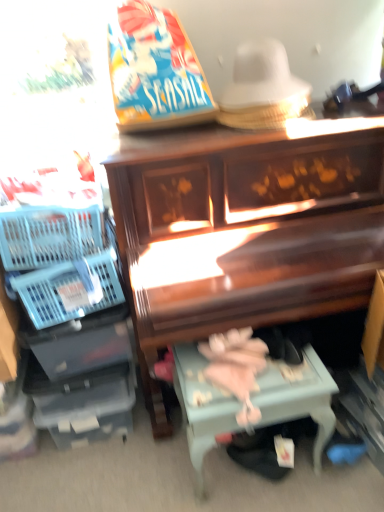
Question: Does blue plastic basket at left have a greater height compared to light blue painted wood table at lower center?

Choices:
 (A) yes
 (B) no

Answer: (B)

Question: From the image's perspective, does blue plastic basket at left appear higher than light blue painted wood table at lower center?

Choices:
 (A) no
 (B) yes

Answer: (B)

Question: From a real-world perspective, is blue plastic basket at left on light blue painted wood table at lower center?

Choices:
 (A) no
 (B) yes

Answer: (B)

Question: Can you confirm if blue plastic basket at left is shorter than light blue painted wood table at lower center?

Choices:
 (A) no
 (B) yes

Answer: (B)

Question: Is blue plastic basket at left completely or partially outside of light blue painted wood table at lower center?

Choices:
 (A) no
 (B) yes

Answer: (B)

Question: Do you think blue plastic basket at left is within light blue painted wood table at lower center, or outside of it?

Choices:
 (A) inside
 (B) outside

Answer: (B)

Question: From a real-world perspective, relative to light blue painted wood table at lower center, is blue plastic basket at left vertically above or below?

Choices:
 (A) below
 (B) above

Answer: (B)

Question: In the image, is blue plastic basket at left on the left side or the right side of light blue painted wood table at lower center?

Choices:
 (A) left
 (B) right

Answer: (A)

Question: From the image's perspective, is blue plastic basket at left above or below light blue painted wood table at lower center?

Choices:
 (A) below
 (B) above

Answer: (B)

Question: From the image's perspective, is wooden piano at center positioned above or below light blue painted wood table at lower center?

Choices:
 (A) below
 (B) above

Answer: (B)

Question: Does point (249, 225) appear closer or farther from the camera than point (195, 440)?

Choices:
 (A) closer
 (B) farther

Answer: (B)

Question: Based on their sizes in the image, would you say wooden piano at center is bigger or smaller than light blue painted wood table at lower center?

Choices:
 (A) big
 (B) small

Answer: (A)

Question: From a real-world perspective, is wooden piano at center above or below light blue painted wood table at lower center?

Choices:
 (A) below
 (B) above

Answer: (B)

Question: From the image's perspective, is blue plastic basket at left located above or below wooden piano at center?

Choices:
 (A) above
 (B) below

Answer: (A)

Question: From a real-world perspective, relative to wooden piano at center, is blue plastic basket at left vertically above or below?

Choices:
 (A) above
 (B) below

Answer: (A)